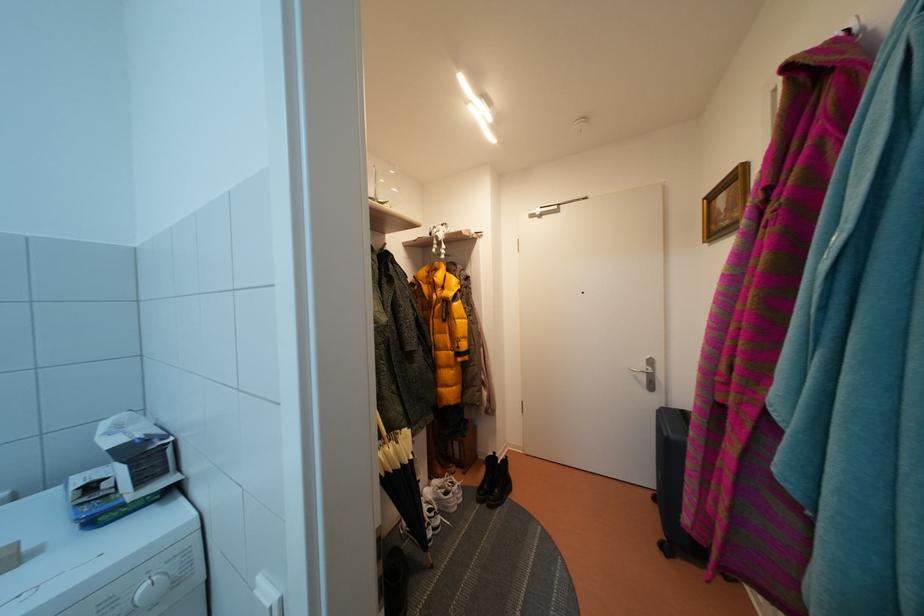
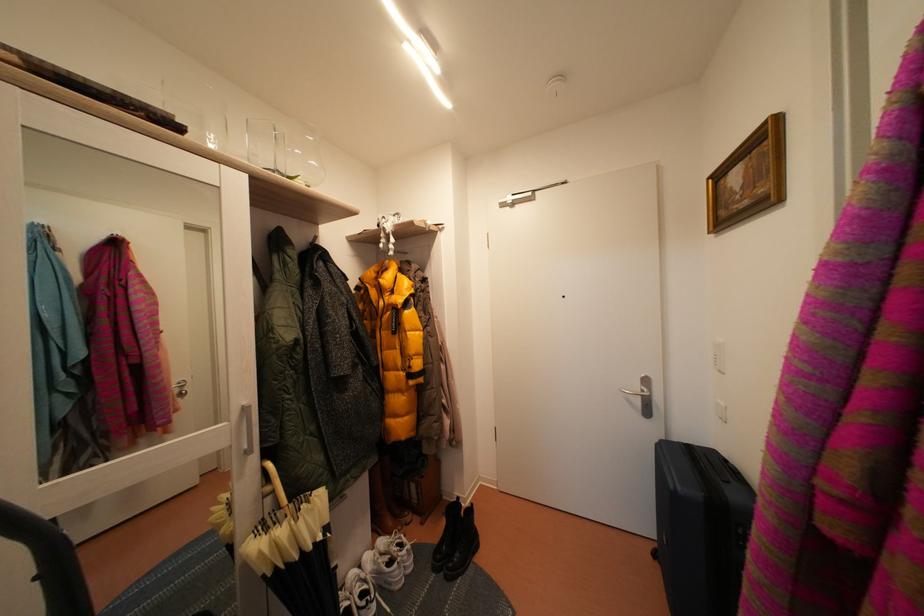
The point at (662,505) is marked in the first image. Where is the corresponding point in the second image?

(662, 561)